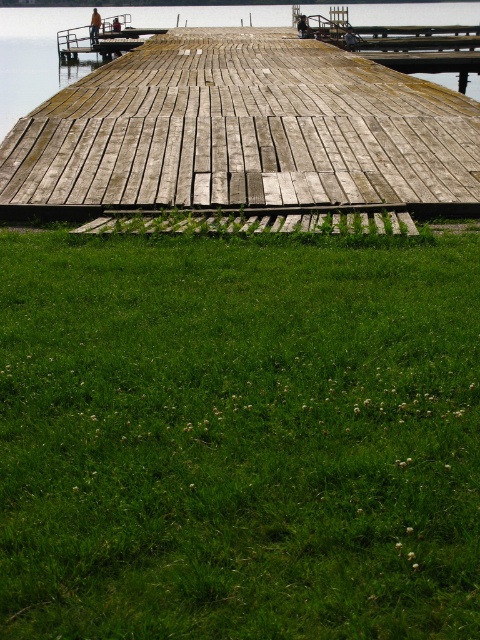
You are a gardener who wants to plant flowers between the green grass at lower center and the weathered wood dock at center. How much distance do you need to cover to reach the dock from the grass?

The distance between the green grass at lower center and the weathered wood dock at center is 20.08 meters, so you need to cover 20.08 meters to reach the dock from the grass.

You are standing on the weathered wood dock at center and want to step onto the green grass at lower center. Which direction should you move to reach it?

You should move to your right because the green grass at lower center is located to the right of the weathered wood dock at center.